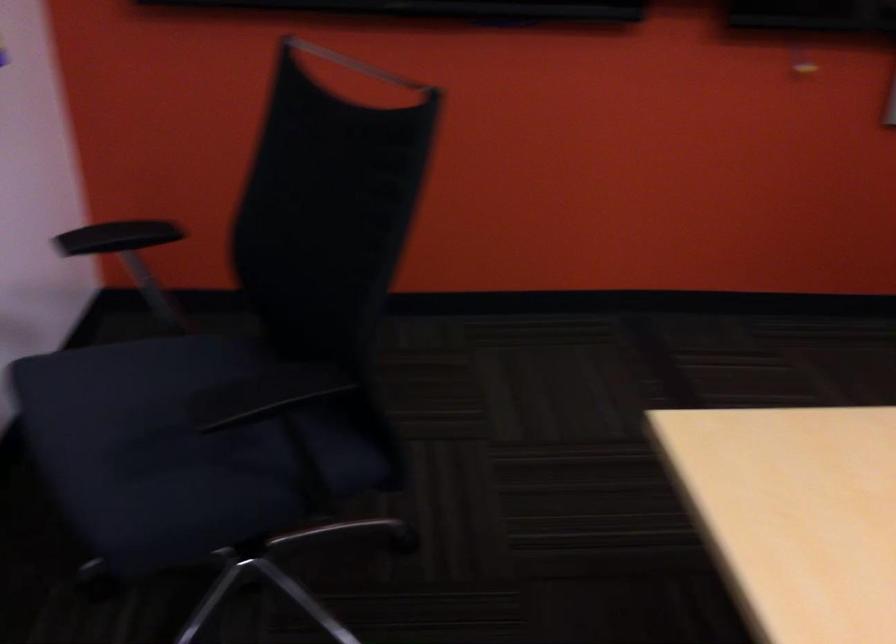
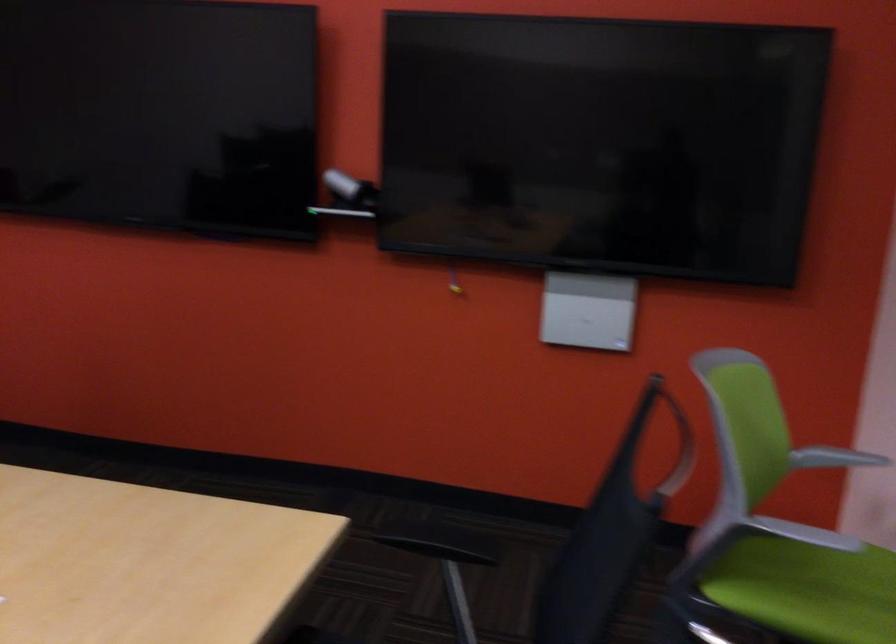
Question: Which direction would the cameraman need to move to produce the second image? Reply with the corresponding letter.

Choices:
 (A) Left
 (B) Right
 (C) Forward
 (D) Backward

Answer: (B)